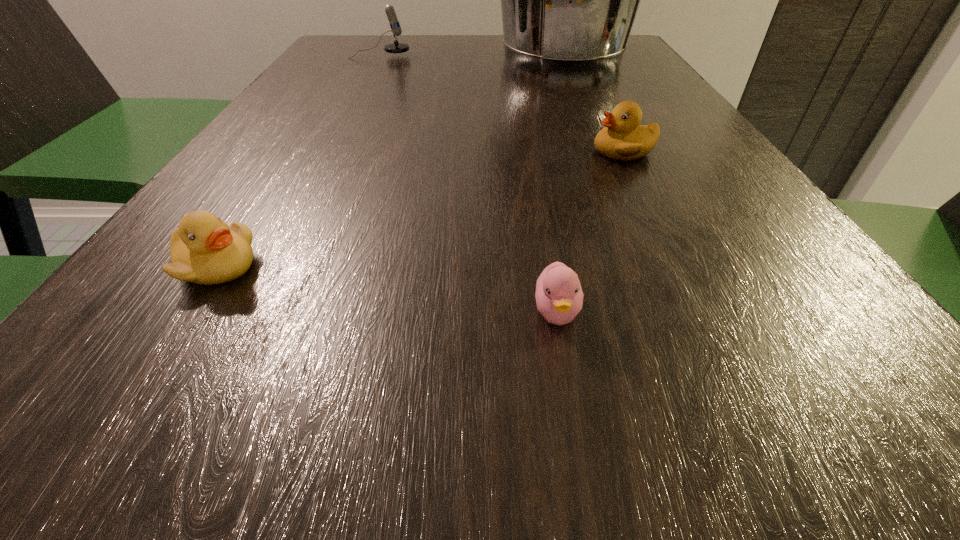
At what (x,y) coordinates should I click in order to perform the action: click on free spot between the farthest duckling and the tallest object. Please return your answer as a coordinate pair (x, y). Looking at the image, I should click on (593, 105).

The width and height of the screenshot is (960, 540). Find the location of `empty location between the fourth shortest object and the leftmost duckling`. empty location between the fourth shortest object and the leftmost duckling is located at coordinates (299, 161).

You are a GUI agent. You are given a task and a screenshot of the screen. Output one action in this format:
    pyautogui.click(x=<x>, y=<y>)
    Task: Click on the empty space between the leftmost duckling and the tallest object
    The image size is (960, 540).
    Given the screenshot: What is the action you would take?
    pyautogui.click(x=390, y=163)

Image resolution: width=960 pixels, height=540 pixels. What are the coordinates of `free area in between the tallest object and the second tallest object` in the screenshot? It's located at (471, 57).

Where is `vacant point located between the second duckling from left to right and the rightmost duckling`? The height and width of the screenshot is (540, 960). vacant point located between the second duckling from left to right and the rightmost duckling is located at coordinates (590, 232).

Identify the location of free space between the leftmost duckling and the bucket. This screenshot has height=540, width=960. (390, 163).

You are a GUI agent. You are given a task and a screenshot of the screen. Output one action in this format:
    pyautogui.click(x=<x>, y=<y>)
    Task: Click on the object that is the second closest to the fourth shortest object
    
    Given the screenshot: What is the action you would take?
    pyautogui.click(x=623, y=138)

Image resolution: width=960 pixels, height=540 pixels. Identify the location of object that is the second closest to the fourth shortest object. (623, 138).

Point out which duckling is positioned as the second nearest to the second duckling from right to left. Please provide its 2D coordinates. Your answer should be formatted as a tuple, i.e. [(x, y)], where the tuple contains the x and y coordinates of a point satisfying the conditions above.

[(204, 250)]

This screenshot has height=540, width=960. I want to click on the closest duckling to the second duckling from right to left, so [x=623, y=138].